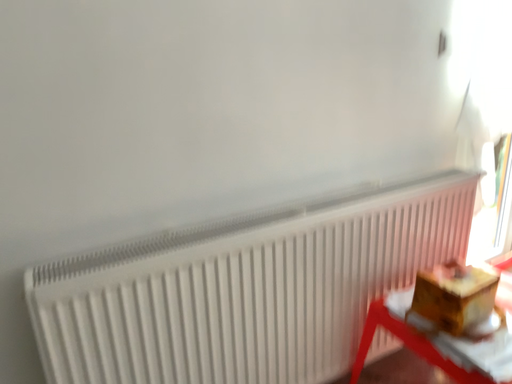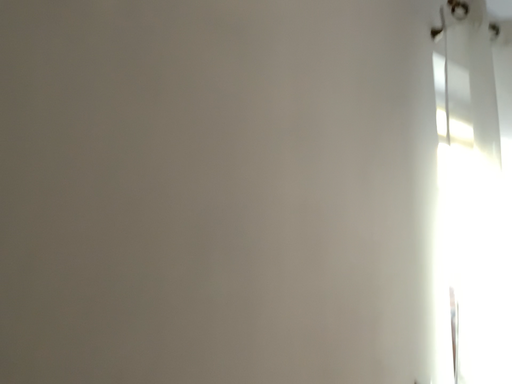
Question: Which way did the camera rotate in the video?

Choices:
 (A) rotated left
 (B) rotated right

Answer: (B)